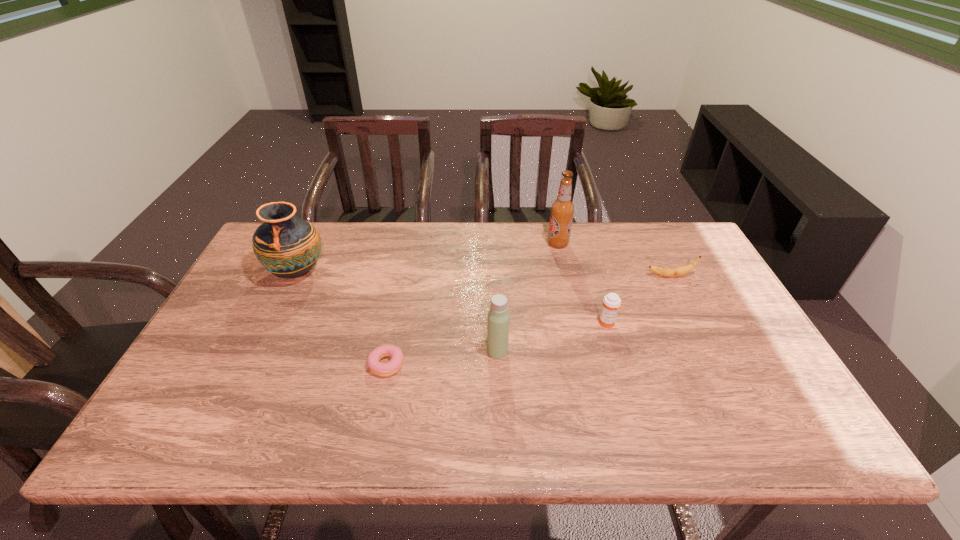
Where is `free spot located 0.350m on the back of the shortest object`? free spot located 0.350m on the back of the shortest object is located at coordinates (406, 263).

Locate an element on the screen. This screenshot has width=960, height=540. beer bottle present at the far edge is located at coordinates (562, 209).

The image size is (960, 540). Find the location of `pottery at the far edge`. pottery at the far edge is located at coordinates (286, 246).

At what (x,y) coordinates should I click in order to perform the action: click on object at the left edge. Please return your answer as a coordinate pair (x, y). Looking at the image, I should click on (286, 246).

The image size is (960, 540). What are the coordinates of `object that is at the right edge` in the screenshot? It's located at (667, 272).

Locate an element on the screen. The image size is (960, 540). object present at the far left corner is located at coordinates (286, 246).

The image size is (960, 540). Identify the location of vacant space at the far edge of the desktop. (531, 228).

In the image, there is a desktop. Find the location of `vacant space at the near edge`. vacant space at the near edge is located at coordinates (720, 416).

Image resolution: width=960 pixels, height=540 pixels. Identify the location of vacant space at the left edge of the desktop. (261, 318).

Locate an element on the screen. The width and height of the screenshot is (960, 540). free space at the near left corner of the desktop is located at coordinates (211, 418).